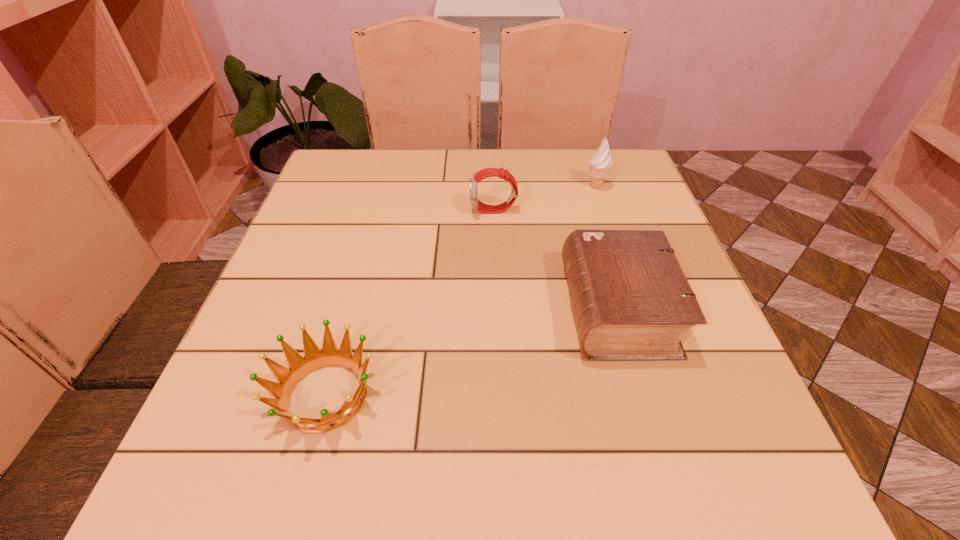
In order to click on object that stands as the third closest to the Bible in this screenshot , I will do `click(299, 367)`.